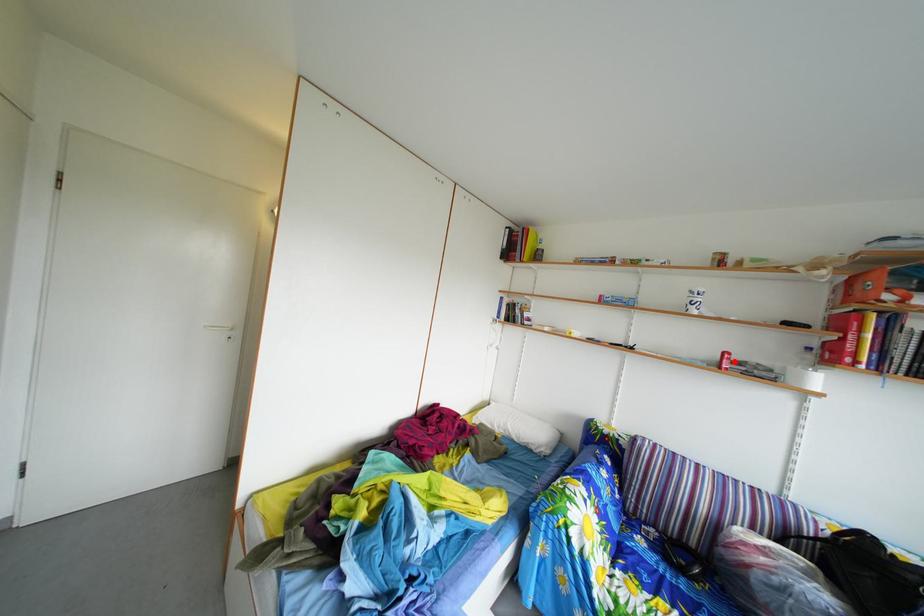
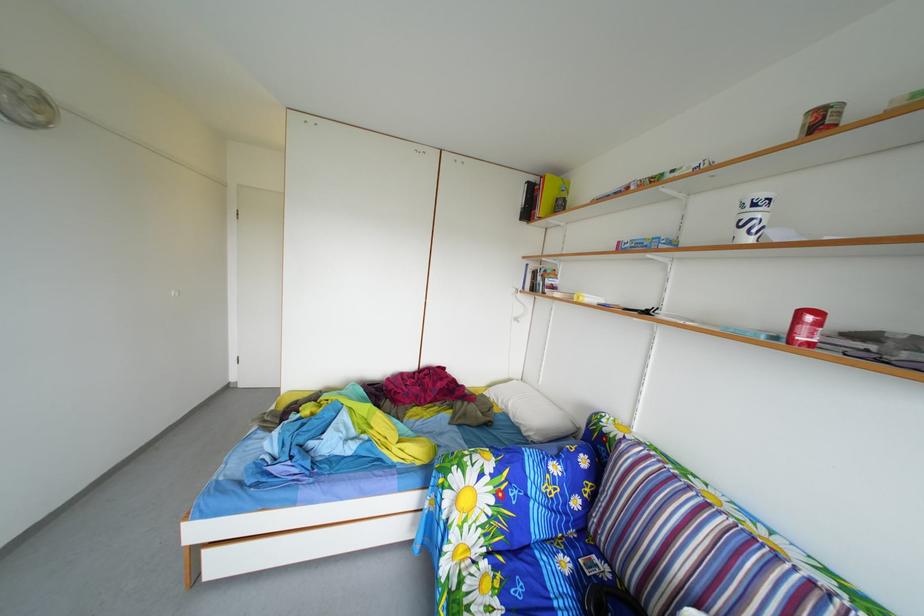
In the second image, find the point that corresponds to the highlighted location in the first image.

(811, 321)